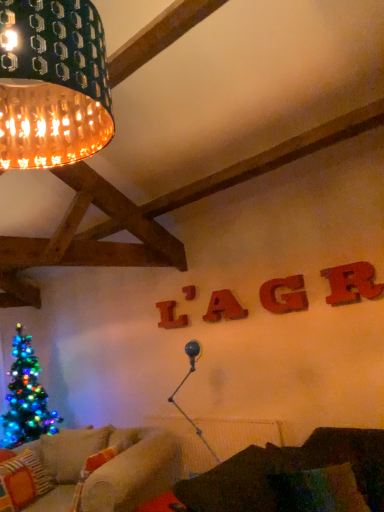
Question: Which direction should I rotate to look at wooden letter at upper center, placed as the 3th letter when sorted from right to left?

Choices:
 (A) right
 (B) left

Answer: (A)

Question: Is the position of knitted wool pillow at lower left less distant than that of wooden letter at upper center, which appears as the 2th letter when viewed from the back?

Choices:
 (A) no
 (B) yes

Answer: (B)

Question: Does knitted wool pillow at lower left appear on the left side of wooden letter at upper center, the second letter from the left?

Choices:
 (A) no
 (B) yes

Answer: (B)

Question: From the image's perspective, is knitted wool pillow at lower left under wooden letter at upper center, which appears as the 2th letter when viewed from the back?

Choices:
 (A) yes
 (B) no

Answer: (A)

Question: Is knitted wool pillow at lower left bigger than wooden letter at upper center, the fourth letter in the front-to-back sequence?

Choices:
 (A) no
 (B) yes

Answer: (B)

Question: Is knitted wool pillow at lower left at the right side of wooden letter at upper center, which appears as the 2th letter when viewed from the back?

Choices:
 (A) no
 (B) yes

Answer: (A)

Question: Does knitted wool pillow at lower left have a greater height compared to wooden letter at upper center, the second letter from the left?

Choices:
 (A) no
 (B) yes

Answer: (B)

Question: From the image's perspective, is wooden letter at center, the 1th letter viewed from the back, below velvet dark brown couch at lower right?

Choices:
 (A) no
 (B) yes

Answer: (A)

Question: Can you confirm if wooden letter at center, the 1th letter viewed from the back, is smaller than velvet dark brown couch at lower right?

Choices:
 (A) yes
 (B) no

Answer: (A)

Question: Is wooden letter at center, the 1th letter viewed from the left, wider than velvet dark brown couch at lower right?

Choices:
 (A) yes
 (B) no

Answer: (B)

Question: Considering the relative sizes of wooden letter at center, which appears as the fifth letter when viewed from the right, and velvet dark brown couch at lower right in the image provided, is wooden letter at center, which appears as the fifth letter when viewed from the right, taller than velvet dark brown couch at lower right?

Choices:
 (A) no
 (B) yes

Answer: (A)

Question: Is wooden letter at center, the 1th letter viewed from the back, outside velvet dark brown couch at lower right?

Choices:
 (A) yes
 (B) no

Answer: (A)

Question: Is wooden letter at center, which appears as the fifth letter when viewed from the right, far away from velvet dark brown couch at lower right?

Choices:
 (A) no
 (B) yes

Answer: (B)

Question: Does wooden letter at upper center, the second letter from the left, have a larger size compared to knitted wool pillow at lower left?

Choices:
 (A) no
 (B) yes

Answer: (A)